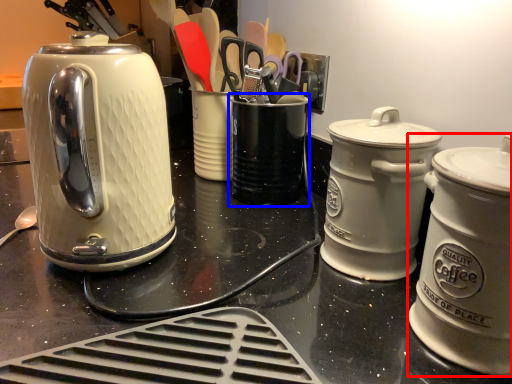
Question: Among these objects, which one is farthest to the camera, kitchen appliance (highlighted by a red box) or appliance (highlighted by a blue box)?

Choices:
 (A) kitchen appliance
 (B) appliance

Answer: (B)